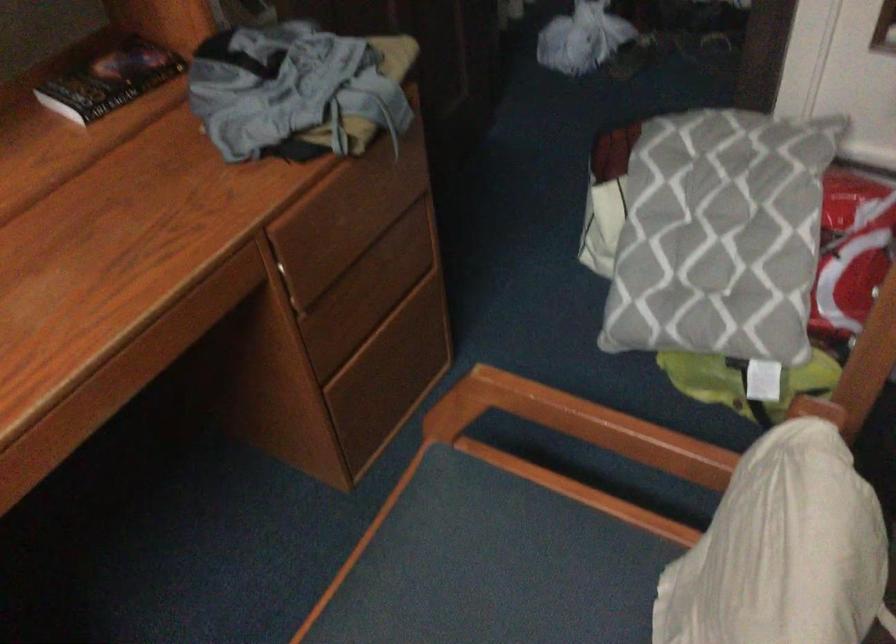
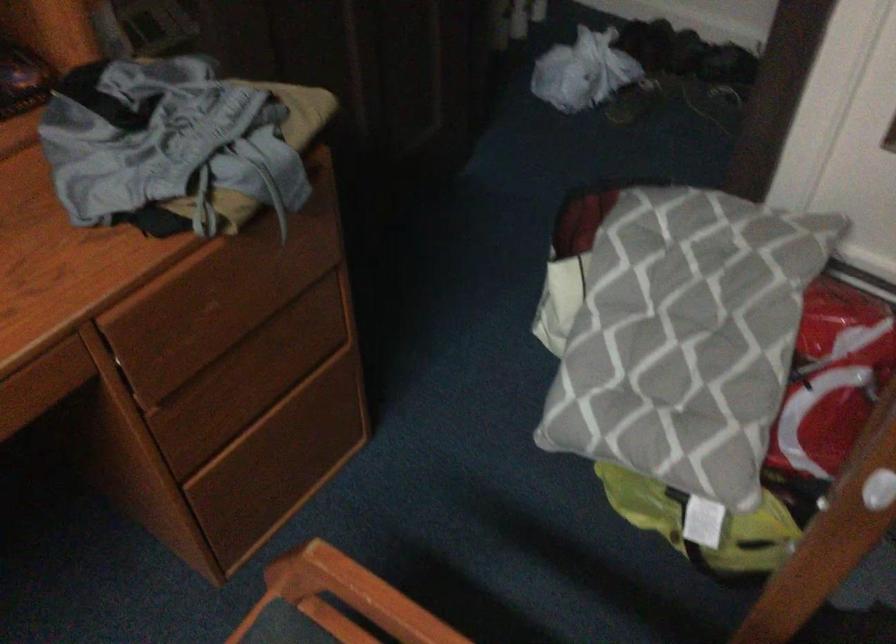
The point at (331, 211) is marked in the first image. Where is the corresponding point in the second image?

(196, 294)